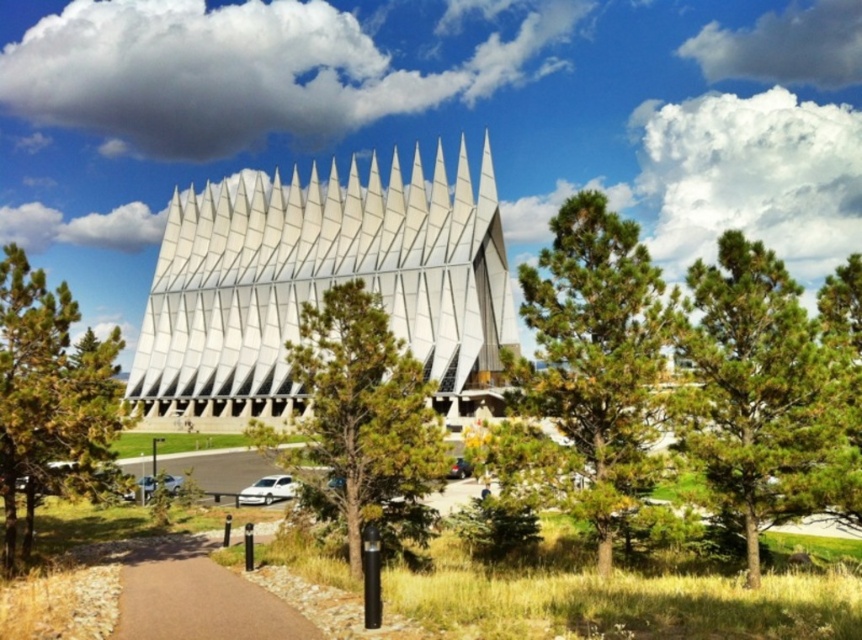
Question: Which of these objects is positioned closest to the white glass building at center?

Choices:
 (A) green textured tree at center-left
 (B) green textured tree at center
 (C) brown asphalt path at lower left

Answer: (B)

Question: Which point is closer to the camera?

Choices:
 (A) green textured tree at center-left
 (B) green textured tree at center
 (C) white glass building at center

Answer: (A)

Question: Estimate the real-world distances between objects in this image. Which object is farther from the green needle-like leaves at center?

Choices:
 (A) green pine tree at upper right
 (B) green textured tree at center-left
 (C) green textured tree at center

Answer: (B)

Question: Is green leafy tree at center below green textured tree at center?

Choices:
 (A) yes
 (B) no

Answer: (B)

Question: Does green needle-like leaves at center have a greater width compared to green leafy tree at center?

Choices:
 (A) no
 (B) yes

Answer: (A)

Question: Is green needle-like leaves at center positioned behind green textured tree at center?

Choices:
 (A) no
 (B) yes

Answer: (A)